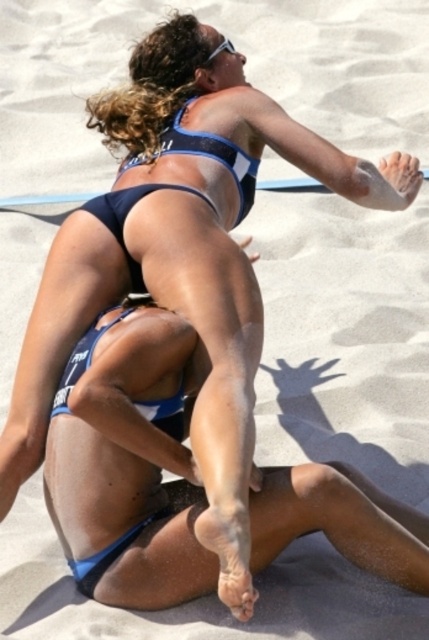
You are a photographer at the beach volleyball match. You want to capture the player wearing the matte blue bikini at center and the blue matte bikini bottom at center in a single shot. Which part of the player requires a wider angle to ensure it fits into the frame?

The matte blue bikini at center requires a wider angle because its width is larger than the blue matte bikini bottom at center.

You are a photographer at the beach volleyball match. You want to capture a photo of the matte blue bikini at center and the blue matte bikini bottom at center. Which one is positioned higher in the image?

The matte blue bikini at center is positioned higher than the blue matte bikini bottom at center in the image.

In the beach volleyball scene, there are two players wearing the matte blue bikini at center and the blue matte bikini bottom at center. Which one is positioned to the right?

The matte blue bikini at center is positioned to the right of the blue matte bikini bottom at center.